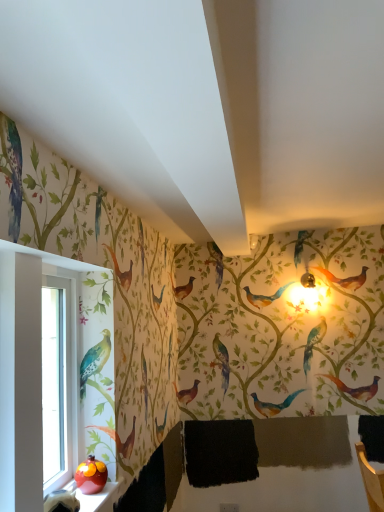
Question: Should I look upward or downward to see clear glass window at left?

Choices:
 (A) up
 (B) down

Answer: (B)